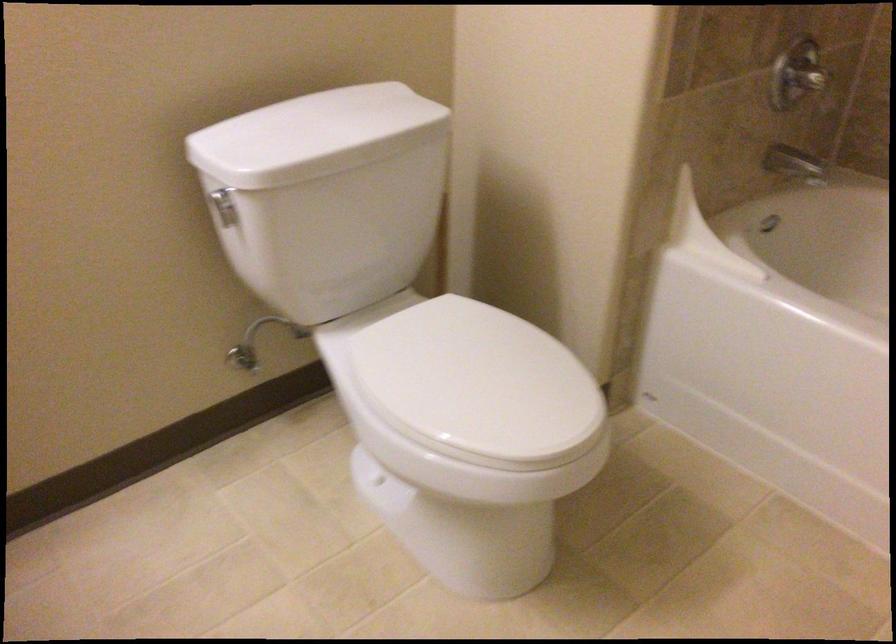
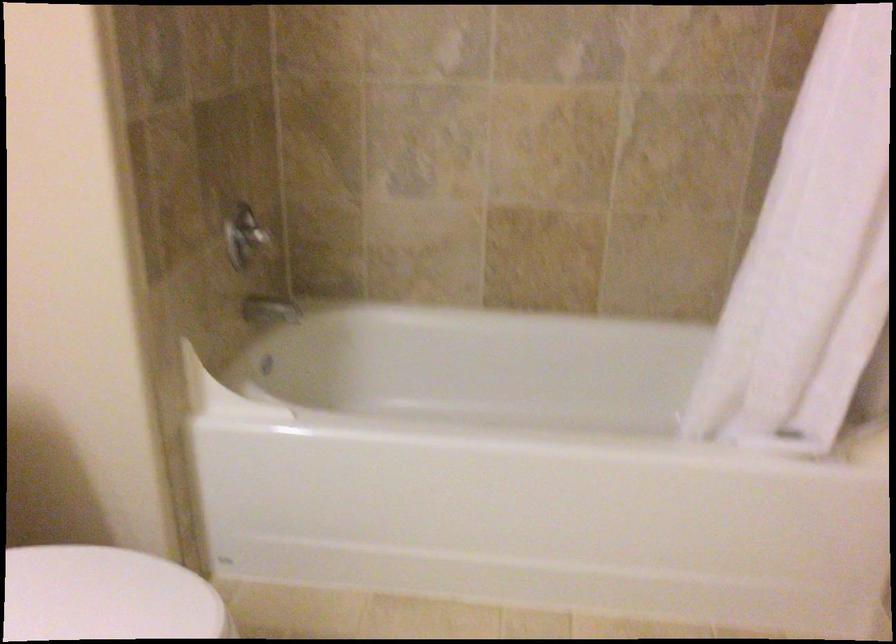
Question: Based on the continuous images, in which direction is the camera rotating? Reply with the corresponding letter.

Choices:
 (A) Left
 (B) Right
 (C) Up
 (D) Down

Answer: (B)